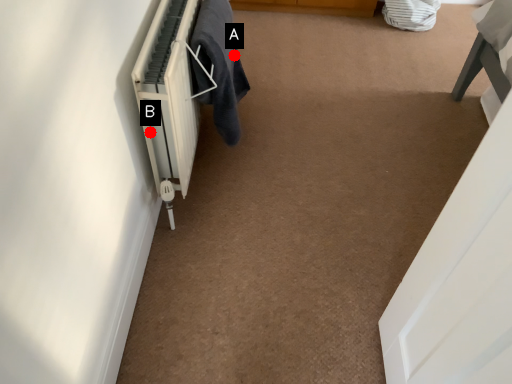
Question: Two points are circled on the image, labeled by A and B beside each circle. Which point is closer to the camera?

Choices:
 (A) A is closer
 (B) B is closer

Answer: (B)